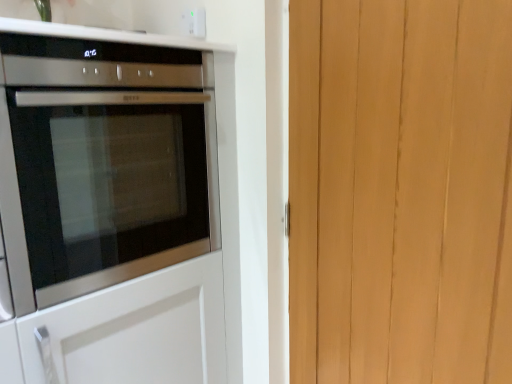
Question: Is light brown wood at right next to white plastic electric outlet at upper center and touching it?

Choices:
 (A) yes
 (B) no

Answer: (B)

Question: Can you confirm if light brown wood at right is bigger than white plastic electric outlet at upper center?

Choices:
 (A) no
 (B) yes

Answer: (B)

Question: Is there a large distance between light brown wood at right and white plastic electric outlet at upper center?

Choices:
 (A) no
 (B) yes

Answer: (A)

Question: Is light brown wood at right not within white plastic electric outlet at upper center?

Choices:
 (A) yes
 (B) no

Answer: (A)

Question: From the image's perspective, is light brown wood at right above white plastic electric outlet at upper center?

Choices:
 (A) yes
 (B) no

Answer: (B)

Question: From a real-world perspective, is light brown wood at right positioned under white plastic electric outlet at upper center based on gravity?

Choices:
 (A) no
 (B) yes

Answer: (B)

Question: Can you confirm if light brown wood at right is taller than satin silver oven at left?

Choices:
 (A) yes
 (B) no

Answer: (A)

Question: Is light brown wood at right smaller than satin silver oven at left?

Choices:
 (A) yes
 (B) no

Answer: (A)

Question: Is light brown wood at right directly adjacent to satin silver oven at left?

Choices:
 (A) yes
 (B) no

Answer: (B)

Question: Is light brown wood at right facing towards satin silver oven at left?

Choices:
 (A) yes
 (B) no

Answer: (B)

Question: From the image's perspective, would you say light brown wood at right is positioned over satin silver oven at left?

Choices:
 (A) no
 (B) yes

Answer: (A)

Question: Would you say light brown wood at right is outside satin silver oven at left?

Choices:
 (A) yes
 (B) no

Answer: (A)

Question: Is white plastic electric outlet at upper center thinner than light brown wood at right?

Choices:
 (A) yes
 (B) no

Answer: (A)